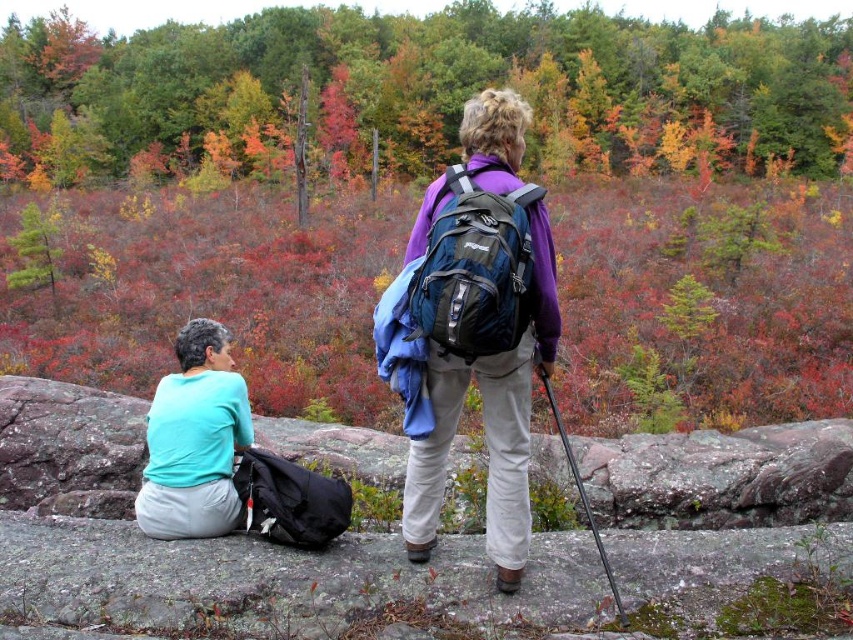
You are a hiker trying to decide which item to grab quickly in case of an emergency. Both the purple matte jacket at center and the blue fabric backpack at center are in your line of sight. Based on their sizes, which item would be easier to reach for?

The purple matte jacket at center is larger in size than the blue fabric backpack at center, so it would be easier to reach for quickly in an emergency due to its larger size making it more accessible.

You are a hiker trying to locate your belongings. You see the autumn leaves at upper center and the purple fabric backpack at center. Which item is closer to you?

The autumn leaves at upper center are closer to you because the purple fabric backpack at center is behind them.